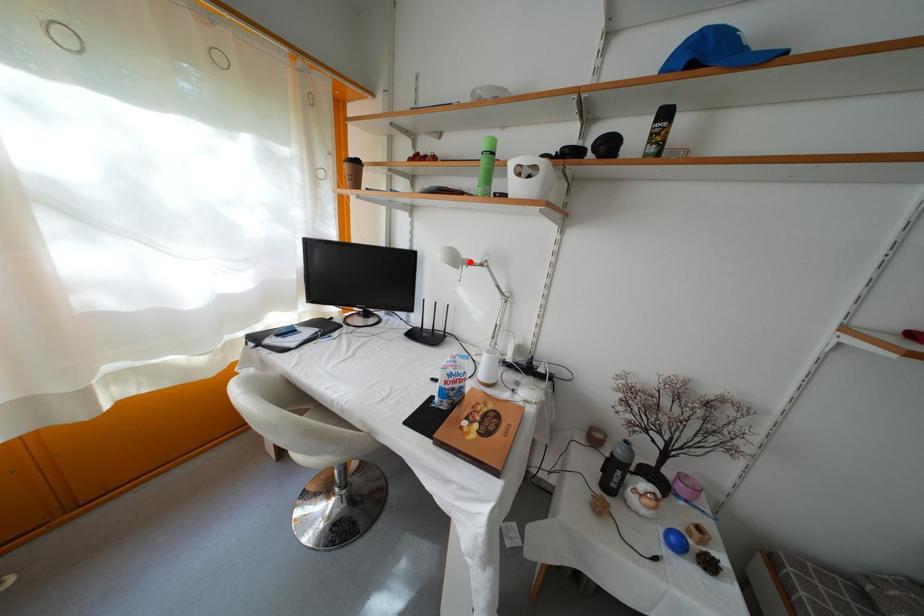
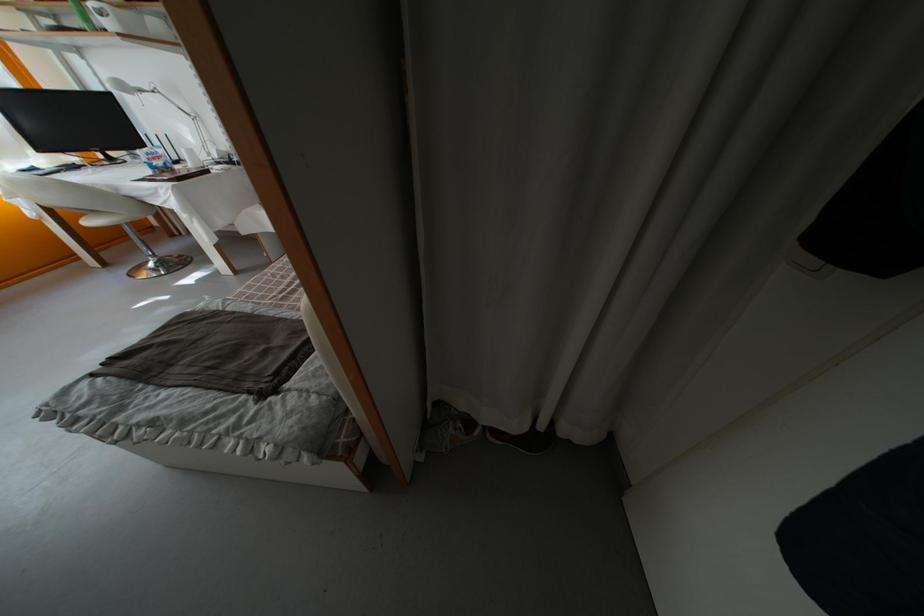
Locate, in the second image, the point that corresponds to the highlighted location in the first image.

(139, 91)